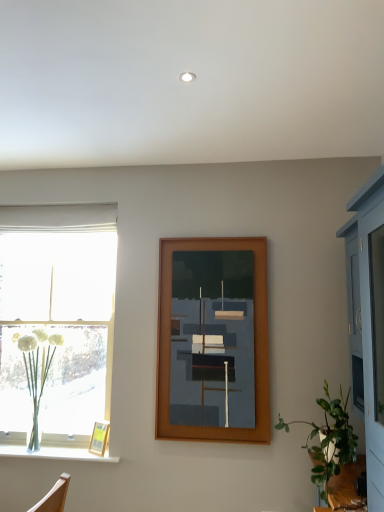
Question: Is wooden picture frame at center, the second picture frame in the bottom-to-top sequence, positioned behind wooden picture frame at lower left, positioned as the first picture frame in bottom-to-top order?

Choices:
 (A) no
 (B) yes

Answer: (A)

Question: Is wooden picture frame at center, placed as the 1th picture frame when sorted from top to bottom, bigger than wooden picture frame at lower left, positioned as the first picture frame in bottom-to-top order?

Choices:
 (A) yes
 (B) no

Answer: (A)

Question: Considering the relative positions of wooden picture frame at center, the second picture frame in the bottom-to-top sequence, and wooden picture frame at lower left, which is the second picture frame from top to bottom, in the image provided, is wooden picture frame at center, the second picture frame in the bottom-to-top sequence, to the left of wooden picture frame at lower left, which is the second picture frame from top to bottom, from the viewer's perspective?

Choices:
 (A) yes
 (B) no

Answer: (B)

Question: Can you confirm if wooden picture frame at center, the second picture frame in the bottom-to-top sequence, is thinner than wooden picture frame at lower left, which ranks as the second picture frame in right-to-left order?

Choices:
 (A) yes
 (B) no

Answer: (B)

Question: Is wooden picture frame at center, placed as the 1th picture frame when sorted from top to bottom, facing away from wooden picture frame at lower left, which is the second picture frame from top to bottom?

Choices:
 (A) yes
 (B) no

Answer: (B)

Question: From a real-world perspective, is green leafy plant at lower right above or below clear glass vase at left?

Choices:
 (A) below
 (B) above

Answer: (A)

Question: Looking at their shapes, would you say green leafy plant at lower right is wider or thinner than clear glass vase at left?

Choices:
 (A) thin
 (B) wide

Answer: (B)

Question: Is point 322,454 closer or farther from the camera than point 56,335?

Choices:
 (A) closer
 (B) farther

Answer: (A)

Question: Considering the positions of green leafy plant at lower right and clear glass vase at left in the image, is green leafy plant at lower right taller or shorter than clear glass vase at left?

Choices:
 (A) short
 (B) tall

Answer: (A)

Question: From a real-world perspective, is clear glass vase at lower left positioned above or below wooden picture frame at lower left, which is the second picture frame from top to bottom?

Choices:
 (A) above
 (B) below

Answer: (B)

Question: Considering their positions, is clear glass vase at lower left located in front of or behind wooden picture frame at lower left, positioned as the first picture frame in bottom-to-top order?

Choices:
 (A) behind
 (B) front

Answer: (B)

Question: Considering the positions of clear glass vase at lower left and wooden picture frame at lower left, placed as the first picture frame when sorted from left to right, in the image, is clear glass vase at lower left taller or shorter than wooden picture frame at lower left, placed as the first picture frame when sorted from left to right,?

Choices:
 (A) short
 (B) tall

Answer: (A)

Question: Visually, is clear glass vase at lower left positioned to the left or to the right of wooden picture frame at lower left, which ranks as the second picture frame in right-to-left order?

Choices:
 (A) right
 (B) left

Answer: (B)

Question: Is white fabric curtain at left wider or thinner than green leafy plant at lower right?

Choices:
 (A) wide
 (B) thin

Answer: (B)

Question: Considering the positions of point (99, 207) and point (352, 458), is point (99, 207) closer or farther from the camera than point (352, 458)?

Choices:
 (A) farther
 (B) closer

Answer: (A)